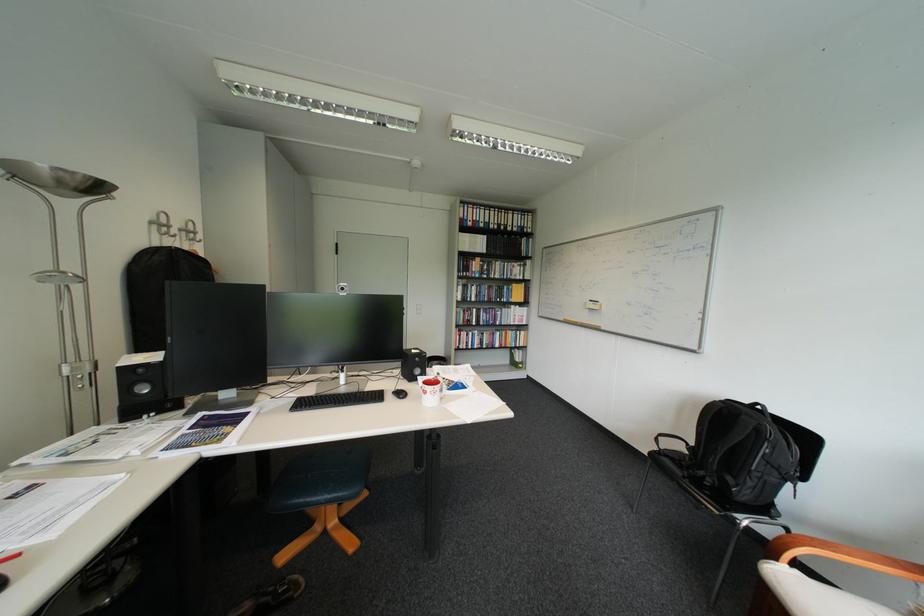
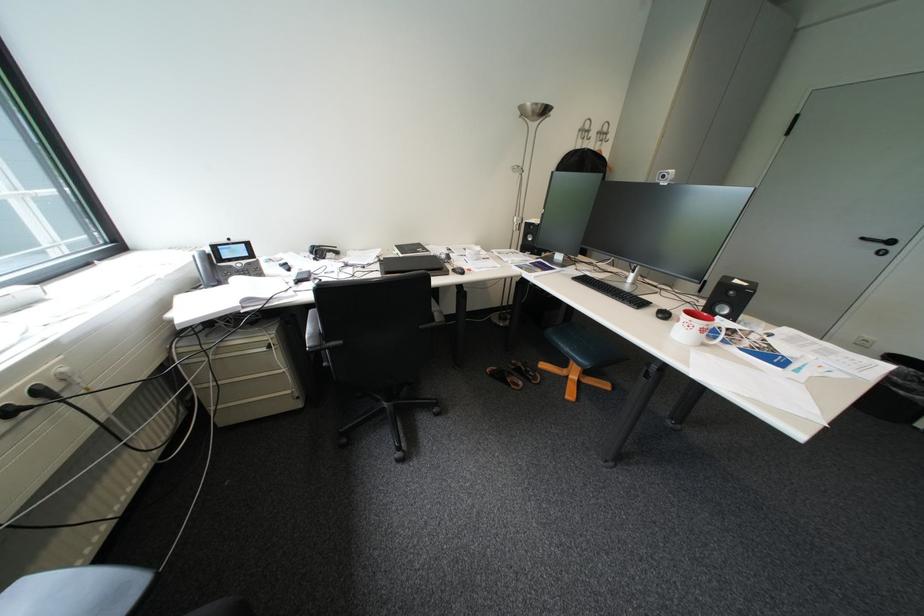
In the second image, find the point that corresponds to (446,392) in the first image.

(700, 326)